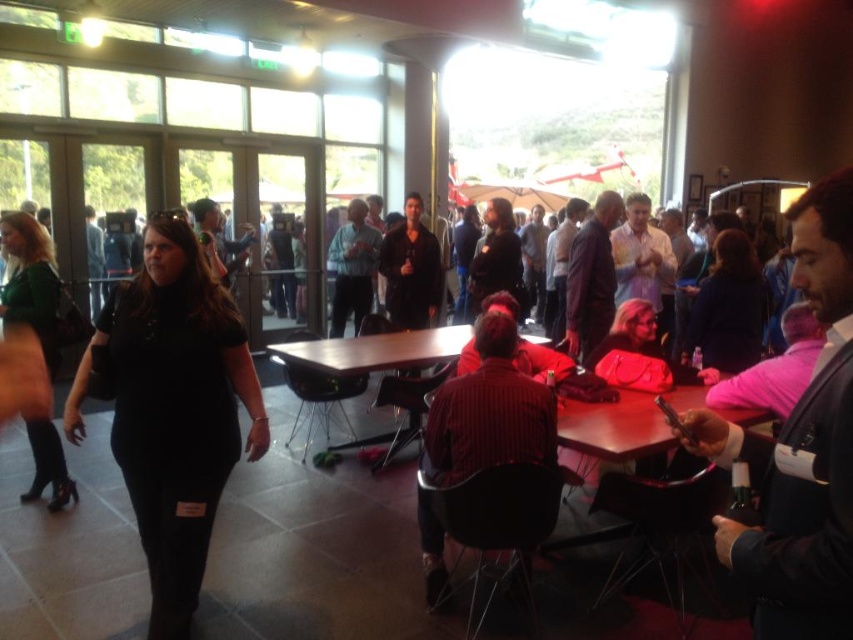
Between green fabric dress at left and wooden table at center, which one appears on the left side from the viewer's perspective?

From the viewer's perspective, green fabric dress at left appears more on the left side.

Does green fabric dress at left have a lesser height compared to wooden table at center?

Incorrect, green fabric dress at left's height does not fall short of wooden table at center's.

The height and width of the screenshot is (640, 853). What are the coordinates of `green fabric dress at left` in the screenshot? It's located at (30, 282).

Image resolution: width=853 pixels, height=640 pixels. I want to click on green fabric dress at left, so click(x=30, y=282).

Is black matte shirt at center bigger than striped shirt at center?

Incorrect, black matte shirt at center is not larger than striped shirt at center.

Who is more forward, (231,419) or (514,438)?

Result: Positioned in front is point (231,419).

Identify the location of black matte shirt at center. (172, 408).

How much distance is there between striped shirt at center and green fabric dress at left?

striped shirt at center is 2.08 meters away from green fabric dress at left.

Locate an element on the screen. The image size is (853, 640). striped shirt at center is located at coordinates (489, 410).

What are the coordinates of `striped shirt at center` in the screenshot? It's located at (489, 410).